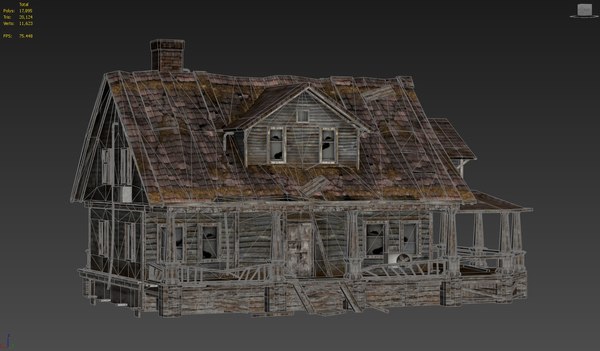
Locate an element on the screen. This screenshot has height=351, width=600. beams sopporting roof is located at coordinates 167,245, 282,234, 351,234, 448,235, 491,233, 517,242, 498,247.